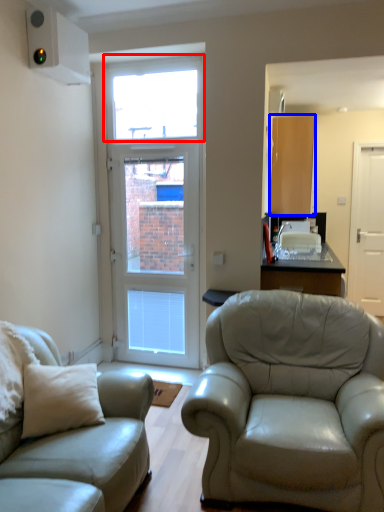
Question: Which point is closer to the camera, window (highlighted by a red box) or cabinetry (highlighted by a blue box)?

Choices:
 (A) window
 (B) cabinetry

Answer: (A)